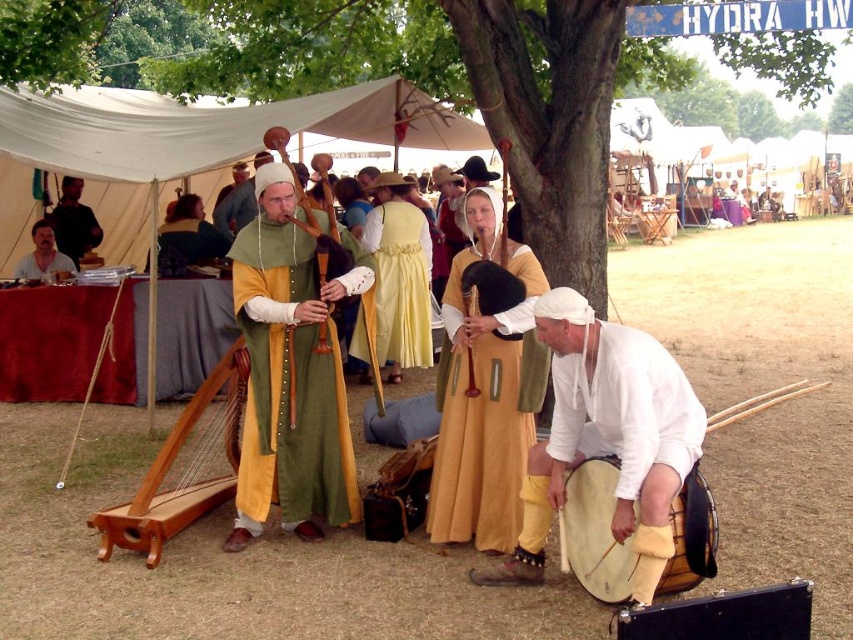
Question: Which of the following is the farthest from the observer?

Choices:
 (A) (612, 330)
 (B) (172, 234)

Answer: (B)

Question: Is white matte drum at lower right above green velvet tunic at center?

Choices:
 (A) yes
 (B) no

Answer: (B)

Question: Can you confirm if light brown drum at lower right is wider than green woolen tunic at center?

Choices:
 (A) no
 (B) yes

Answer: (A)

Question: Which object is closer to the camera taking this photo?

Choices:
 (A) dark brown leather jacket at upper left
 (B) green woolen tunic at center

Answer: (B)

Question: Among these objects, which one is farthest from the camera?

Choices:
 (A) yellow satin dress at center
 (B) white matte drum at lower right
 (C) matte yellow dress at center

Answer: (A)

Question: Is matte yellow dress at center wider than yellow satin dress at center?

Choices:
 (A) yes
 (B) no

Answer: (B)